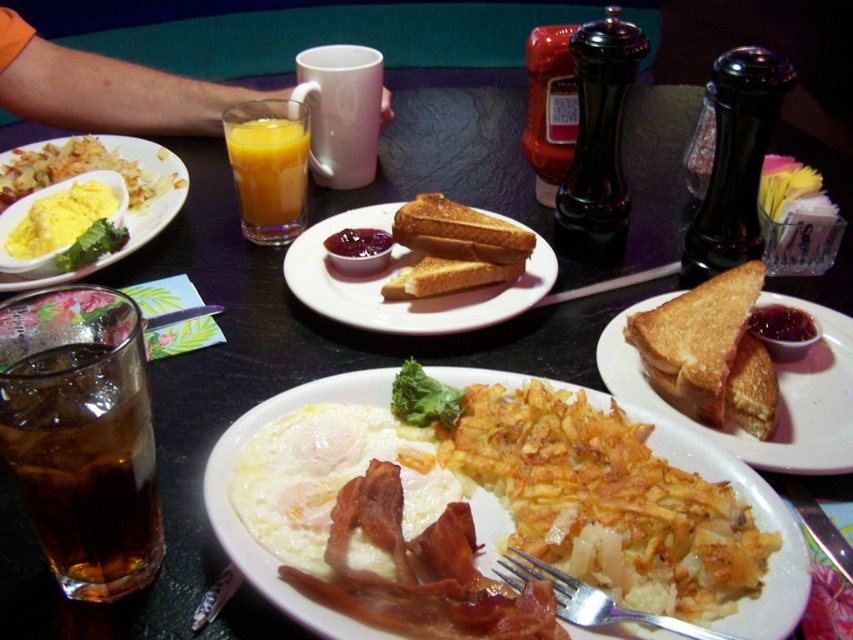
Question: Which object is positioned closest to the matte yellow eggs at center?

Choices:
 (A) white fried egg at center
 (B) slightly toasted bread at center
 (C) yellow matte egg at upper left

Answer: (C)

Question: Which of these objects is positioned farthest from the silver metallic fork at lower center?

Choices:
 (A) orange liquid at center
 (B) matte white plate at center
 (C) brown translucent glass at lower left

Answer: (A)

Question: Does brown translucent glass at lower left appear under orange liquid at center?

Choices:
 (A) yes
 (B) no

Answer: (A)

Question: Which point is farther from the camera taking this photo?

Choices:
 (A) (421, 321)
 (B) (45, 208)
 (C) (146, 468)
 (D) (403, 508)

Answer: (B)

Question: Can you confirm if slightly toasted bread at center is bigger than silver metallic fork at lower center?

Choices:
 (A) no
 (B) yes

Answer: (B)

Question: Is white fried egg at center below slightly toasted bread at center?

Choices:
 (A) no
 (B) yes

Answer: (B)